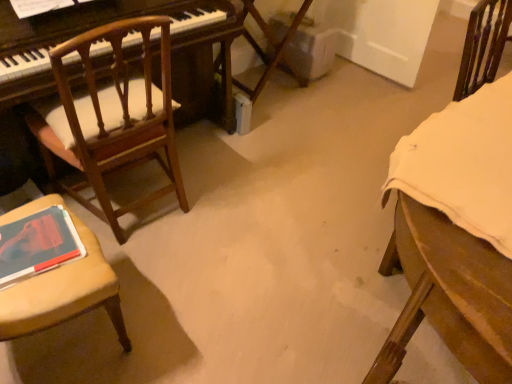
Identify the location of vacant area that is in front of wooden chair with cushion at left, marked as the 2th chair in a left-to-right arrangement. (164, 277).